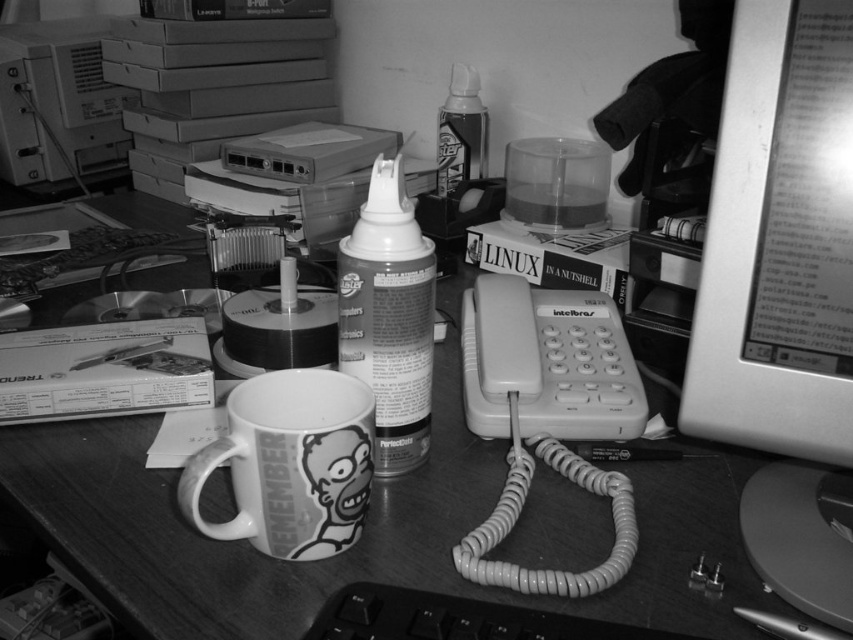
Locate an element on the screen. The image size is (853, 640). satin white spray can at center is located at coordinates (389, 316).

Between satin white spray can at center and black plastic keyboard at lower center, which one is positioned lower?

black plastic keyboard at lower center is lower down.

Between satin white spray can at center and black plastic keyboard at lower center, which one has less height?

black plastic keyboard at lower center is shorter.

Is point (374, 330) farther from viewer compared to point (554, 637)?

Yes.

At what (x,y) coordinates should I click in order to perform the action: click on satin white spray can at center. Please return your answer as a coordinate pair (x, y). Looking at the image, I should click on (389, 316).

Does point (287, 531) come closer to viewer compared to point (99, 76)?

Yes, it is.

Does white ceramic mug at center have a greater width compared to matte plastic desktop computer at upper left?

No, white ceramic mug at center is not wider than matte plastic desktop computer at upper left.

Find the location of a particular element. white ceramic mug at center is located at coordinates (289, 464).

At what (x,y) coordinates should I click in order to perform the action: click on white ceramic mug at center. Please return your answer as a coordinate pair (x, y). This screenshot has height=640, width=853. Looking at the image, I should click on (289, 464).